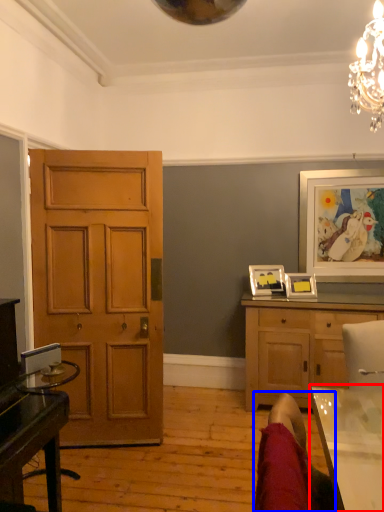
Question: Which of the following is the closest to the observer, table (highlighted by a red box) or swivel chair (highlighted by a blue box)?

Choices:
 (A) table
 (B) swivel chair

Answer: (B)